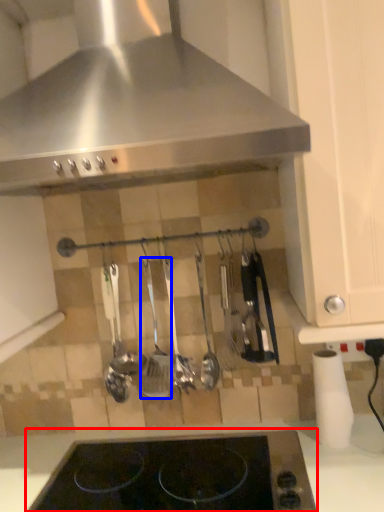
Question: Which of the following is the closest to the observer, gas stove (highlighted by a red box) or silverware (highlighted by a blue box)?

Choices:
 (A) gas stove
 (B) silverware

Answer: (A)